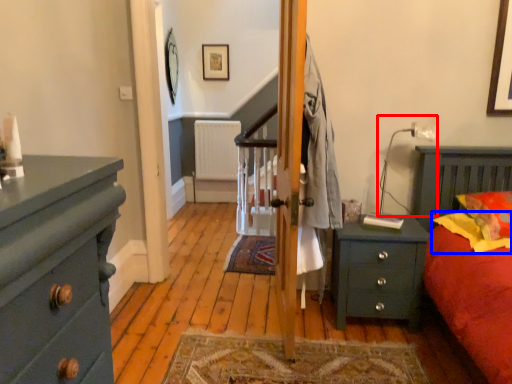
Question: Which of the following is the closest to the observer, lamp (highlighted by a red box) or pillow (highlighted by a blue box)?

Choices:
 (A) lamp
 (B) pillow

Answer: (B)